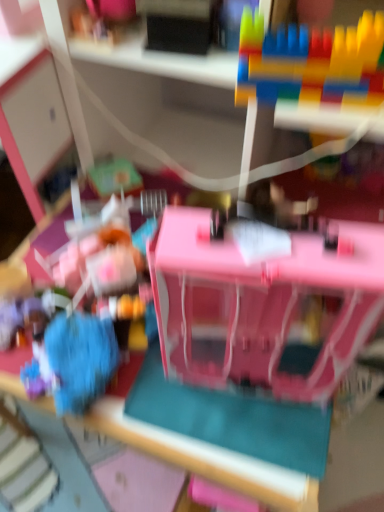
This screenshot has width=384, height=512. I want to click on vacant location behind blue fuzzy ball at lower left, the 3th toy from the right, so click(x=44, y=285).